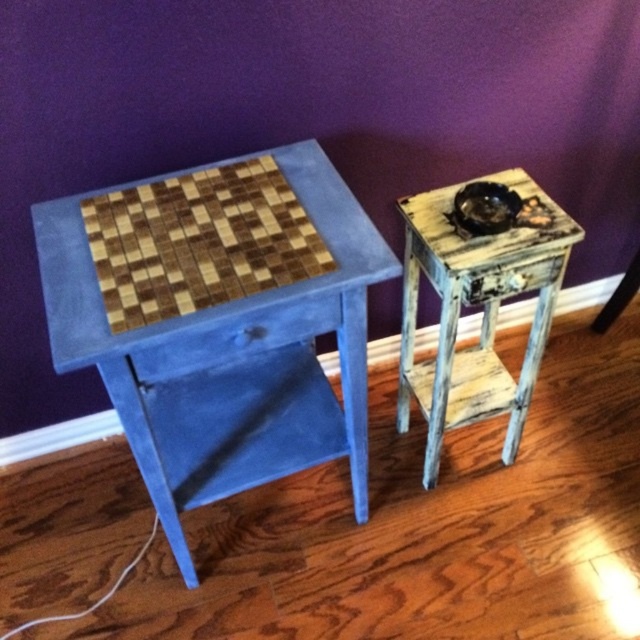
You are arranging flowers in a living room with the image shown. You have a tall vase that needs to be placed on a table. The blue painted wood table at left and the distressed wood side table at right are available. Which table should you choose to ensure the vase won not fall over?

The blue painted wood table at left is positioned under the distressed wood side table at right, meaning it has a lower height. Choose the blue painted wood table at left for the vase as it has a more stable base to prevent the vase from tipping over.

You are standing in a room with a blue painted wood table at left. You want to place a 1 meter long decorative item on the floor between you and the table. Is there enough space?

The blue painted wood table at left is 82.36 centimeters from viewer, so placing a 1 meter long decorative item on the floor between you and the table would not be possible since the distance is shorter than the item length.